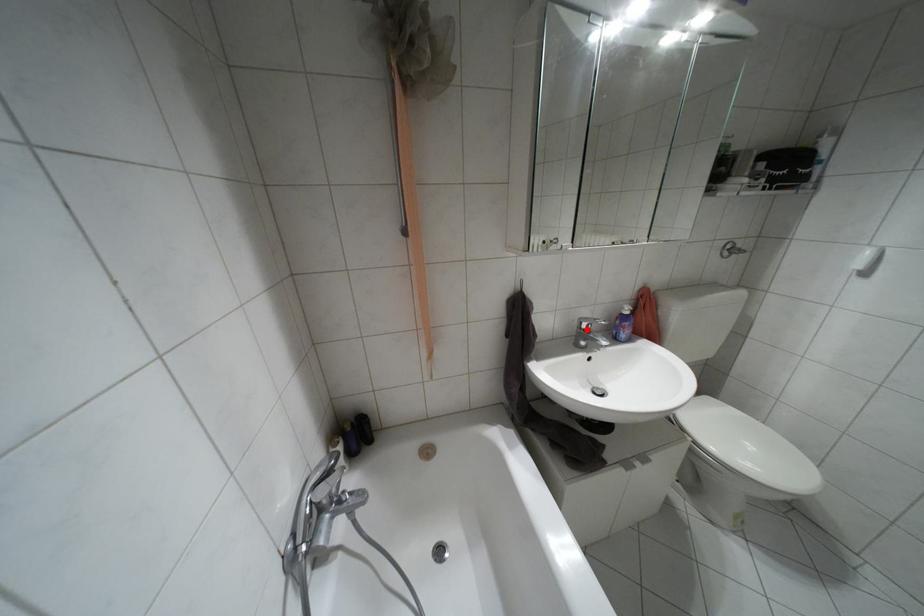
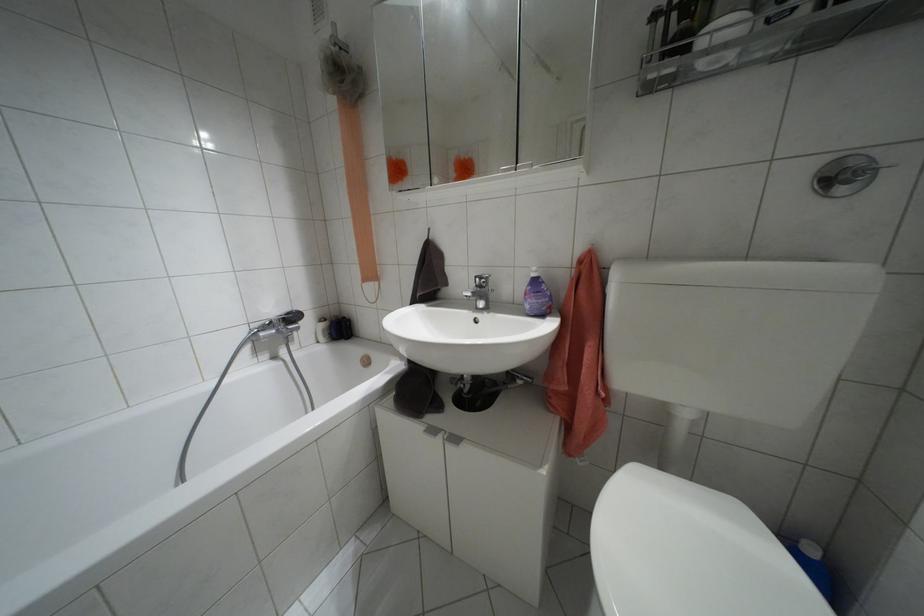
In the second image, find the point that corresponds to the highlighted location in the first image.

(479, 286)